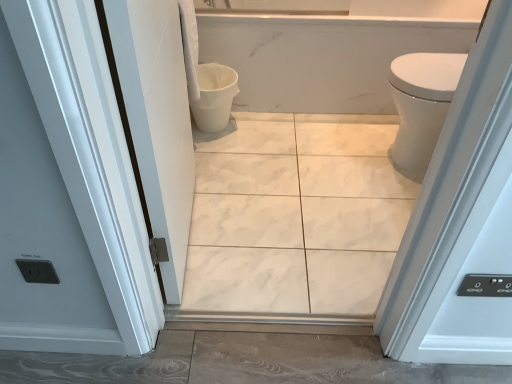
Where is `free space to the left of white glossy bidet at right`? Image resolution: width=512 pixels, height=384 pixels. free space to the left of white glossy bidet at right is located at coordinates (333, 163).